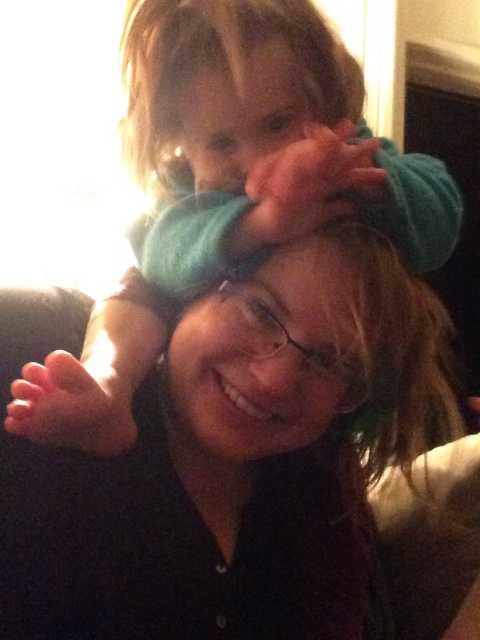
Question: Estimate the real-world distances between objects in this image. Which object is farther from the matte blue beanie at center?

Choices:
 (A) matte blue beanie at upper center
 (B) blurred teal hat at upper center

Answer: (B)

Question: Does matte blue beanie at upper center appear on the left side of blurred teal hat at upper center?

Choices:
 (A) yes
 (B) no

Answer: (B)

Question: Is soft teal blanket at upper center to the left of matte blue beanie at center from the viewer's perspective?

Choices:
 (A) yes
 (B) no

Answer: (A)

Question: Which object appears farthest from the camera in this image?

Choices:
 (A) blurred teal hat at upper center
 (B) soft teal blanket at upper center

Answer: (A)

Question: Does soft teal blanket at upper center have a smaller size compared to black fabric shoulder at upper right?

Choices:
 (A) yes
 (B) no

Answer: (A)

Question: Which object is positioned closest to the matte blue beanie at center?

Choices:
 (A) blurred teal hat at upper center
 (B) matte blue beanie at upper center
 (C) soft teal blanket at upper center

Answer: (B)